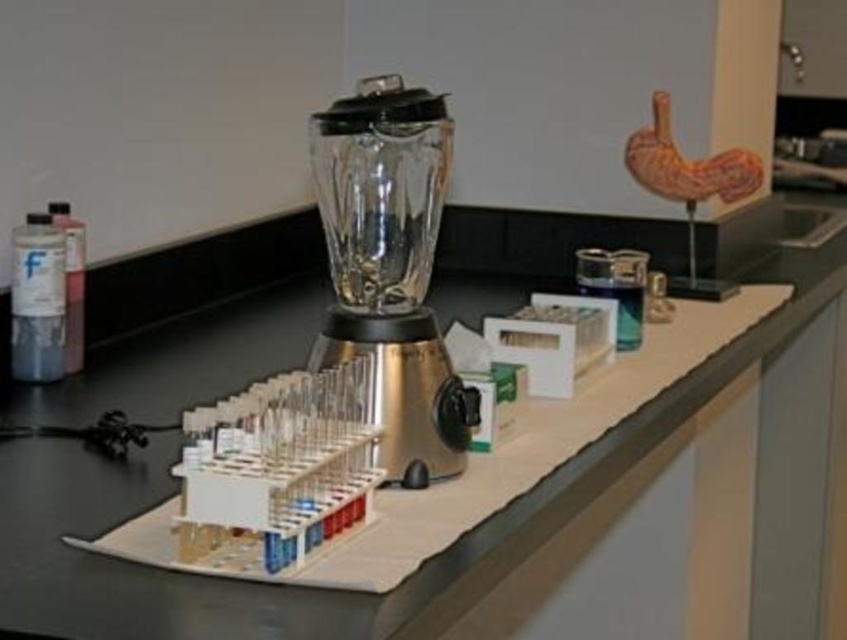
Is black plastic counter at center above translucent glass blender at center?

Yes, black plastic counter at center is above translucent glass blender at center.

Is black plastic counter at center smaller than translucent glass blender at center?

Incorrect, black plastic counter at center is not smaller in size than translucent glass blender at center.

Does point (674, 419) come in front of point (380, 177)?

No, (674, 419) is behind (380, 177).

Locate an element on the screen. black plastic counter at center is located at coordinates (329, 589).